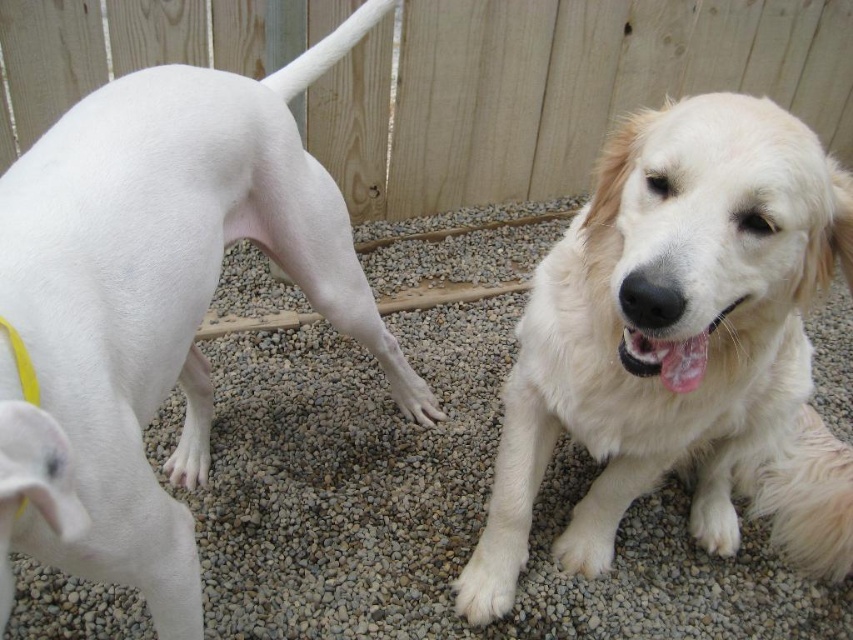
Is golden fur dog at center further to camera compared to white fur at lower left?

That is False.

Does golden fur dog at center appear on the left side of white fur at lower left?

Incorrect, golden fur dog at center is not on the left side of white fur at lower left.

I want to click on golden fur dog at center, so click(x=682, y=339).

Find the location of a particular element. golden fur dog at center is located at coordinates (x=682, y=339).

Is point (183, 170) positioned behind point (613, 65)?

No, (183, 170) is closer to viewer.

Which is in front, point (166, 561) or point (567, 22)?

Point (166, 561) is in front.

Locate an element on the screen. white smooth dog at left is located at coordinates pyautogui.click(x=154, y=304).

Does wooden fence at upper center appear on the left side of white fur at lower left?

No, wooden fence at upper center is not to the left of white fur at lower left.

Who is positioned more to the right, wooden fence at upper center or white fur at lower left?

wooden fence at upper center is more to the right.

Between point (412, 19) and point (173, 472), which one is positioned behind?

Point (412, 19)

Find the location of a particular element. wooden fence at upper center is located at coordinates (556, 88).